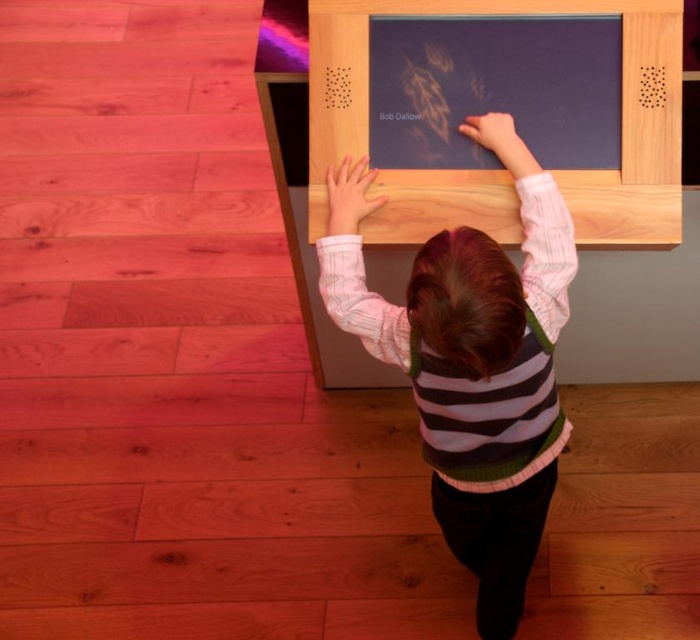
Question: Which point is farther to the camera?

Choices:
 (A) matte wooden board at upper center
 (B) black glossy text at upper center

Answer: (B)

Question: Can you confirm if matte wooden board at upper center is wider than black glossy text at upper center?

Choices:
 (A) yes
 (B) no

Answer: (A)

Question: Does striped sweater at center have a lesser width compared to matte wooden board at upper center?

Choices:
 (A) yes
 (B) no

Answer: (A)

Question: Does striped sweater at center have a greater width compared to black glossy text at upper center?

Choices:
 (A) yes
 (B) no

Answer: (A)

Question: Which object appears farthest from the camera in this image?

Choices:
 (A) matte wooden board at upper center
 (B) black glossy text at upper center

Answer: (B)

Question: Which point is farther from the camera taking this photo?

Choices:
 (A) (363, 22)
 (B) (413, 278)

Answer: (A)